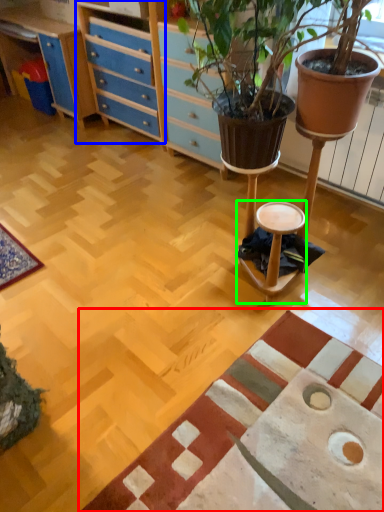
Question: Estimate the real-world distances between objects in this image. Which object is closer to mat (highlighted by a red box), file cabinet (highlighted by a blue box) or stool (highlighted by a green box)?

Choices:
 (A) file cabinet
 (B) stool

Answer: (B)